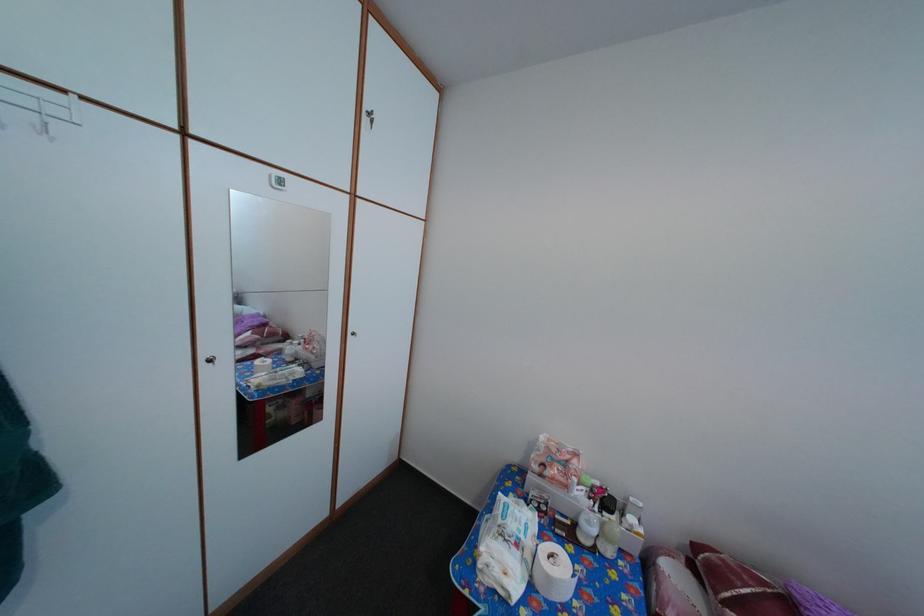
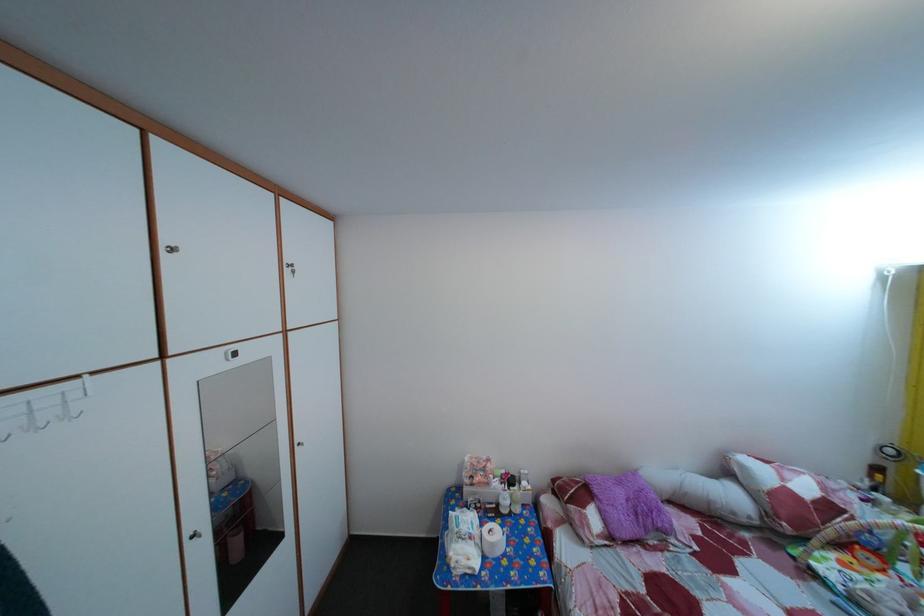
In the second image, find the point that corresponds to (623,507) in the first image.

(524, 485)